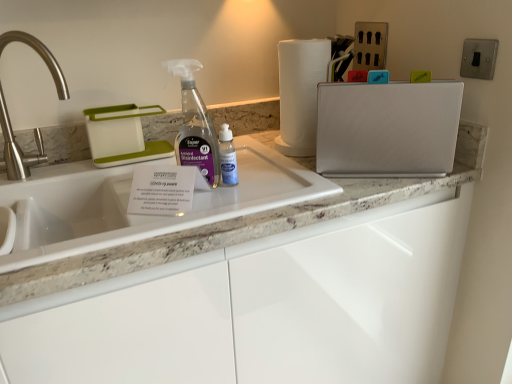
Question: Is white plastic dish rack at upper left, which is counted as the second appliance, starting from the right, directly adjacent to white marble countertop at center?

Choices:
 (A) no
 (B) yes

Answer: (A)

Question: Does white plastic dish rack at upper left, which is counted as the second appliance, starting from the right, have a greater height compared to white marble countertop at center?

Choices:
 (A) yes
 (B) no

Answer: (A)

Question: Can you confirm if white plastic dish rack at upper left, which is counted as the second appliance, starting from the right, is bigger than white marble countertop at center?

Choices:
 (A) no
 (B) yes

Answer: (A)

Question: Is white plastic dish rack at upper left, the first appliance viewed from the left, far away from white marble countertop at center?

Choices:
 (A) yes
 (B) no

Answer: (B)

Question: Could you tell me if white plastic dish rack at upper left, which is counted as the second appliance, starting from the right, is facing white marble countertop at center?

Choices:
 (A) yes
 (B) no

Answer: (A)

Question: From a real-world perspective, is white plastic dish rack at upper left, which is counted as the second appliance, starting from the right, under white marble countertop at center?

Choices:
 (A) yes
 (B) no

Answer: (B)

Question: Is white plastic dish rack at upper left, which is counted as the second appliance, starting from the right, to the right of brushed metal faucet at left from the viewer's perspective?

Choices:
 (A) yes
 (B) no

Answer: (A)

Question: Would you say white plastic dish rack at upper left, which is counted as the second appliance, starting from the right, contains brushed metal faucet at left?

Choices:
 (A) no
 (B) yes

Answer: (A)

Question: From the image's perspective, would you say white plastic dish rack at upper left, which is counted as the second appliance, starting from the right, is shown under brushed metal faucet at left?

Choices:
 (A) yes
 (B) no

Answer: (A)

Question: Is white plastic dish rack at upper left, which is counted as the second appliance, starting from the right, bigger than brushed metal faucet at left?

Choices:
 (A) no
 (B) yes

Answer: (A)

Question: From the image's perspective, is white plastic dish rack at upper left, the first appliance viewed from the left, on top of brushed metal faucet at left?

Choices:
 (A) no
 (B) yes

Answer: (A)

Question: Considering the relative positions of white plastic dish rack at upper left, which is counted as the second appliance, starting from the right, and brushed metal faucet at left in the image provided, is white plastic dish rack at upper left, which is counted as the second appliance, starting from the right, to the left of brushed metal faucet at left from the viewer's perspective?

Choices:
 (A) yes
 (B) no

Answer: (B)

Question: Considering the relative sizes of brushed metal faucet at left and metallic switch at upper right in the image provided, is brushed metal faucet at left thinner than metallic switch at upper right?

Choices:
 (A) yes
 (B) no

Answer: (B)